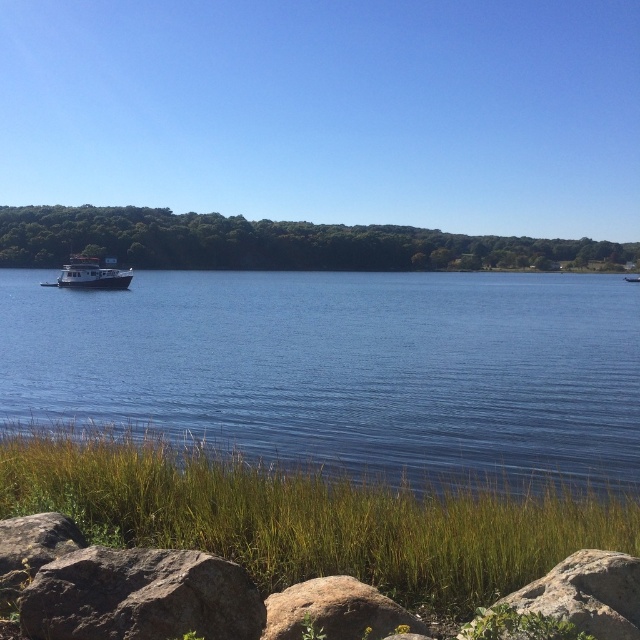
You are standing at the edge of the lake and see the smooth gray rock at lower left and the white glossy houseboat at left. Which object is closer to the water surface?

The smooth gray rock at lower left is positioned under the white glossy houseboat at left, so the rock is closer to the water surface than the houseboat.

You are standing at the point marked by the coordinate point at point (336, 611). Looking around, you see a small boat with a white cabin and dark hull anchored near the left side of the frame. Which direction should you walk to reach the boat?

The point (336, 611) is on brown rough rock at lower center. Since the boat is anchored near the left side of the frame, you should walk towards the left to reach the boat.

You are standing at the edge of the lakeside and want to place a 2.5 meter long wooden board between the brown rough rock at lower center and the smooth gray rock at lower left. Is there enough space between them to fit the board?

The distance between the brown rough rock at lower center and the smooth gray rock at lower left is 2.33 meters. Since the wooden board is 2.5 meters long, it is slightly longer than the space available. Therefore, the board cannot fit between them.